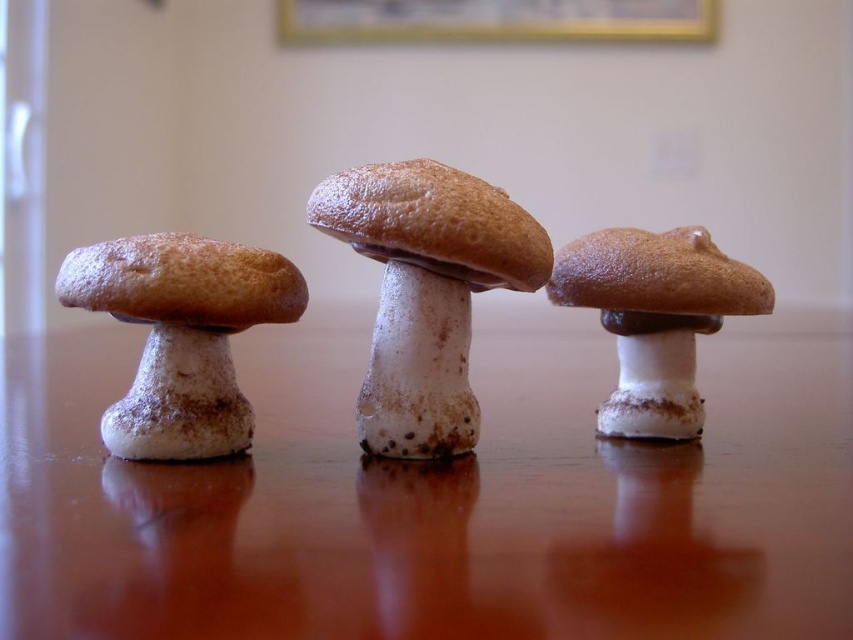
You are arranging mushrooms on a table. You have a matte brown mushroom at left and a brown matte mushroom at center. Based on their positions, which one is closer to the edge of the table?

The matte brown mushroom at left is closer to the edge of the table because it is positioned below the brown matte mushroom at center, which places it lower in the arrangement.